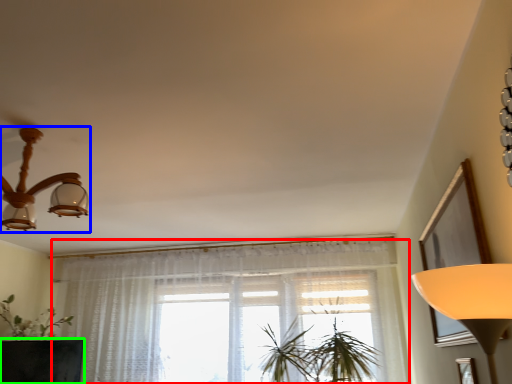
Question: Estimate the real-world distances between objects in this image. Which object is farther from curtain (highlighted by a red box), lamp (highlighted by a blue box) or round table (highlighted by a green box)?

Choices:
 (A) lamp
 (B) round table

Answer: (A)